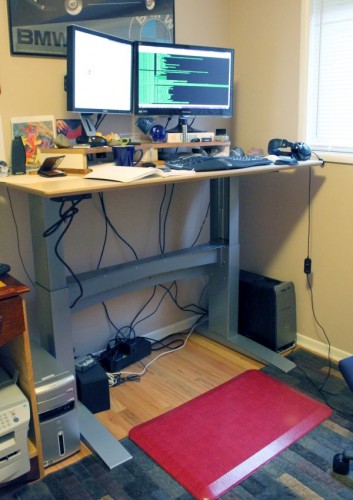
Locate an element on the screen. This screenshot has width=353, height=500. wooden standing desk with metal legs is located at coordinates [x=74, y=184].